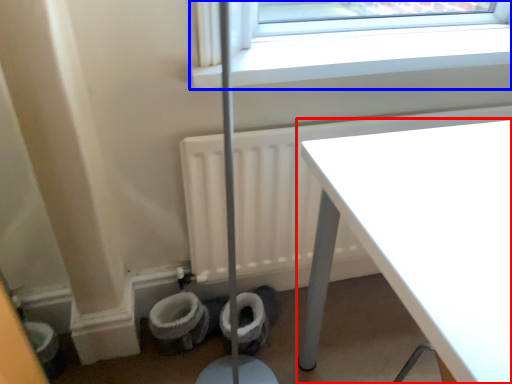
Question: Which of the following is the farthest to the observer, table (highlighted by a red box) or window (highlighted by a blue box)?

Choices:
 (A) table
 (B) window

Answer: (B)